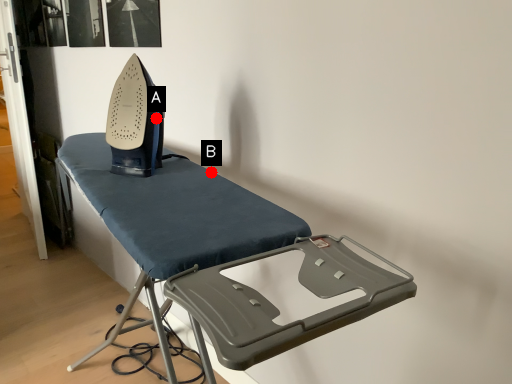
Question: Two points are circled on the image, labeled by A and B beside each circle. Which point is closer to the camera?

Choices:
 (A) A is closer
 (B) B is closer

Answer: (B)